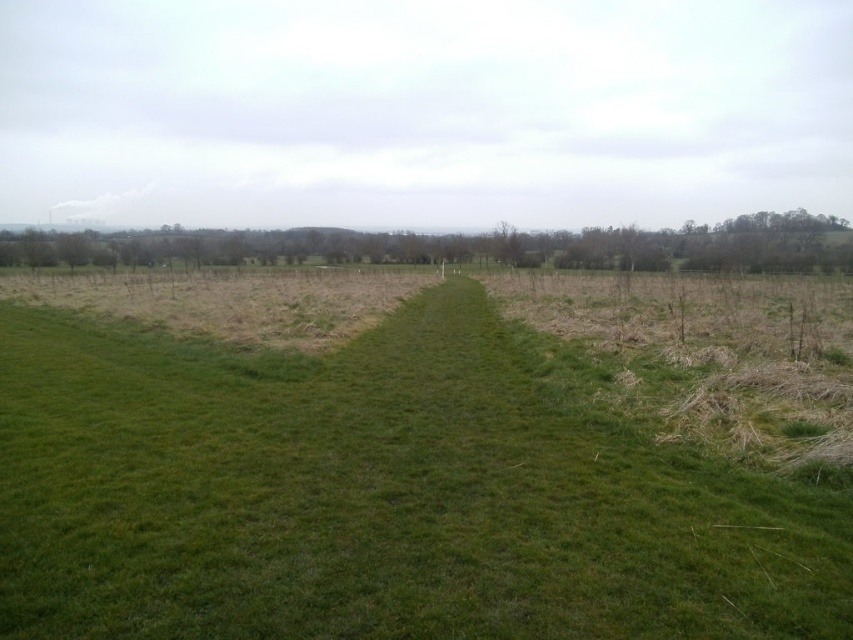
Question: Does green grassy path at center have a smaller size compared to green grassy field at left?

Choices:
 (A) no
 (B) yes

Answer: (B)

Question: Can you confirm if green grassy path at center is thinner than green grassy field at left?

Choices:
 (A) no
 (B) yes

Answer: (B)

Question: Which point is farther to the camera?

Choices:
 (A) (3, 260)
 (B) (234, 442)

Answer: (A)

Question: Which object appears closest to the camera in this image?

Choices:
 (A) green grassy path at center
 (B) green grassy field at left

Answer: (A)

Question: Does green grassy path at center come in front of green grassy field at left?

Choices:
 (A) yes
 (B) no

Answer: (A)